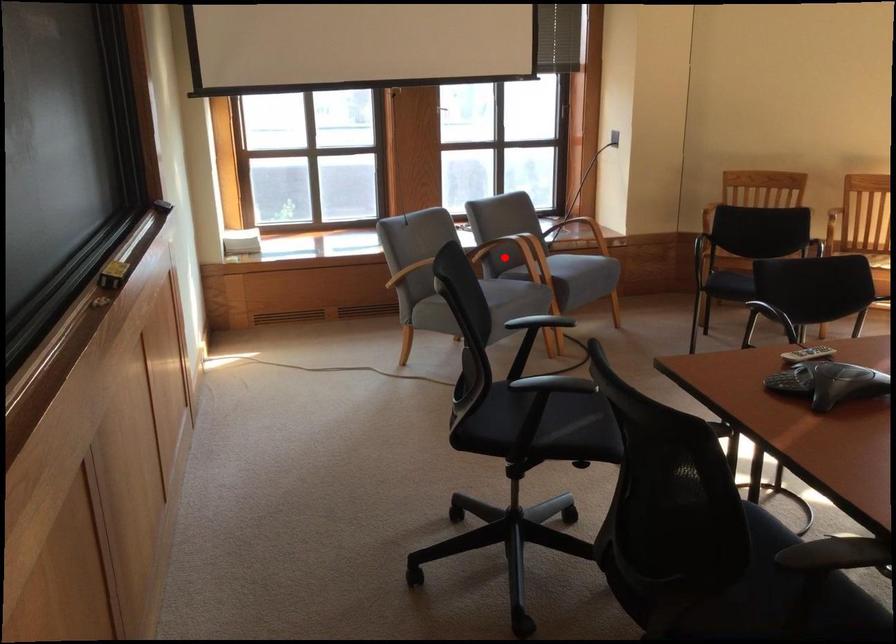
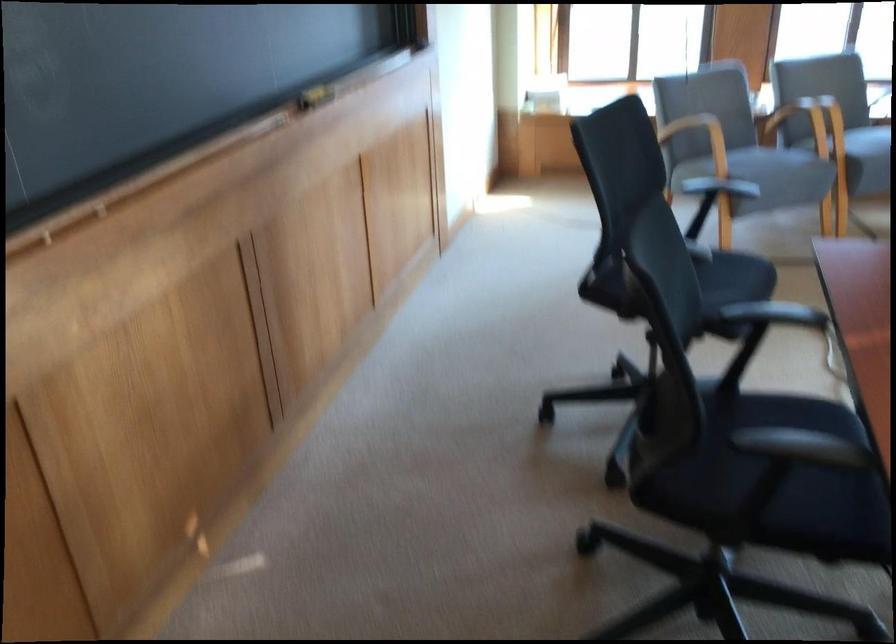
Question: A red point is marked in image1. In image2, is the corresponding 3D point closer to the camera or farther? Reply with the corresponding letter.

Choices:
 (A) The corresponding 3D point is closer.
 (B) The corresponding 3D point is farther.

Answer: (A)